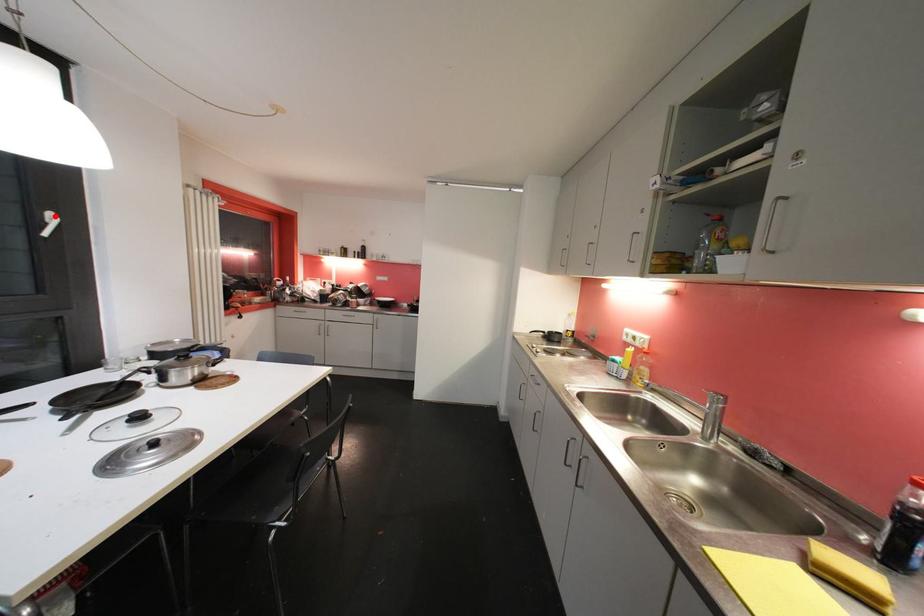
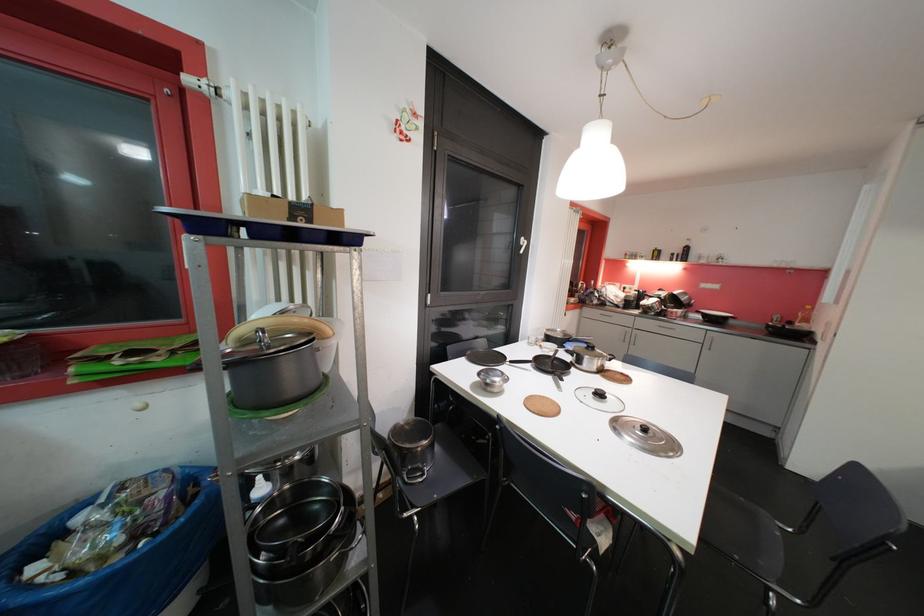
The point at the highlighted location is marked in the first image. Where is the corresponding point in the second image?

(528, 241)